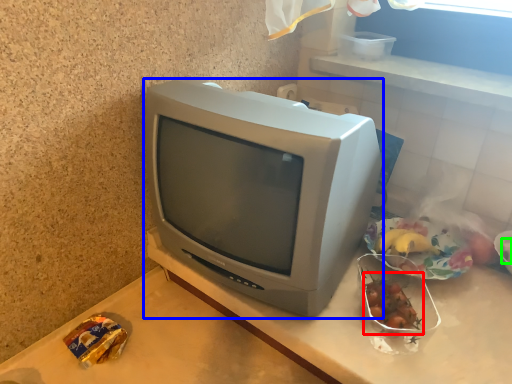
Question: Which object is positioned closest to food (highlighted by a red box)? Select from television (highlighted by a blue box) and food (highlighted by a green box).

Choices:
 (A) television
 (B) food

Answer: (A)